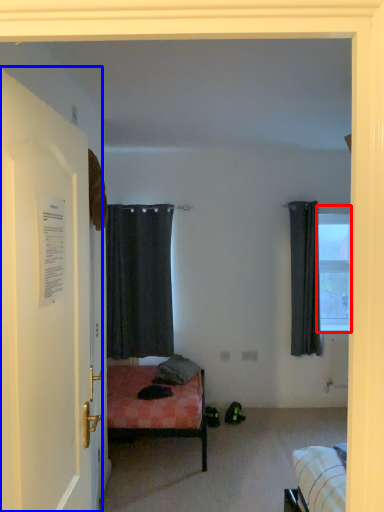
Question: Which object appears farthest to the camera in this image, window (highlighted by a red box) or door (highlighted by a blue box)?

Choices:
 (A) window
 (B) door

Answer: (A)